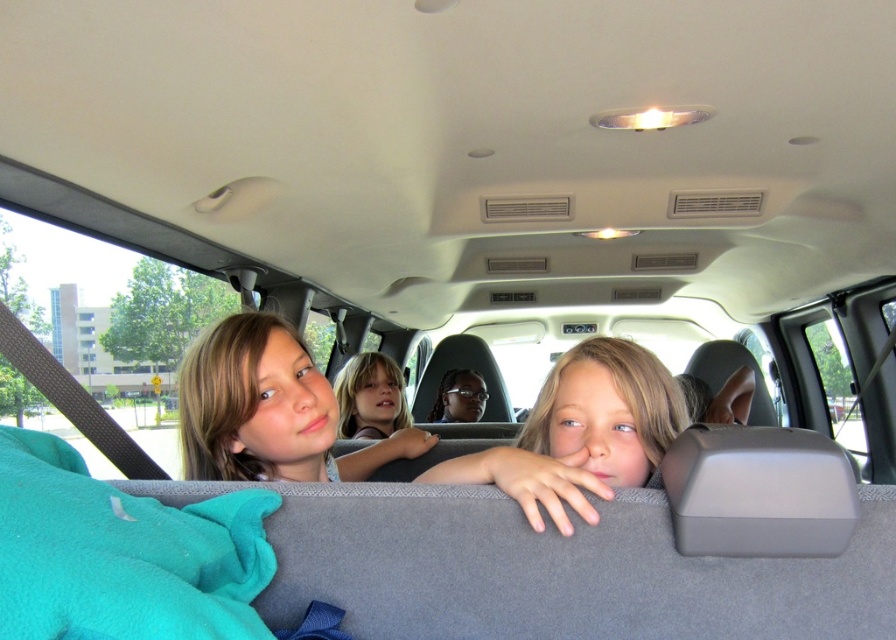
Is point (238, 467) less distant than point (360, 364)?

Yes, point (238, 467) is in front of point (360, 364).

Does blonde hair at center come in front of smooth skin face at center?

Yes, it is in front of smooth skin face at center.

What do you see at coordinates (268, 410) in the screenshot? The width and height of the screenshot is (896, 640). I see `blonde hair at center` at bounding box center [268, 410].

In order to click on blonde hair at center in this screenshot , I will do `click(268, 410)`.